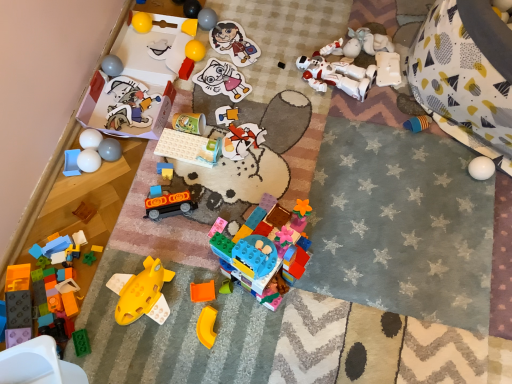
Find the location of a particular element. This screenshot has width=512, height=384. vacant space situated on the left part of yellow matte plastic piece at center, the seventeenth toy viewed from the left is located at coordinates (151, 336).